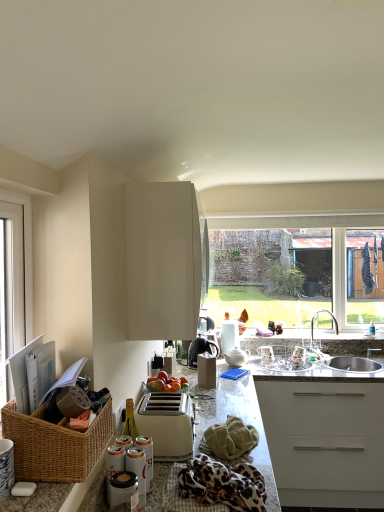
Question: Do you think white plastic toaster at center is within metallic silver can at lower center, the 1th appliance when ordered from front to back, or outside of it?

Choices:
 (A) outside
 (B) inside

Answer: (A)

Question: From a real-world perspective, is white plastic toaster at center above or below metallic silver can at lower center, which is the third appliance in back-to-front order?

Choices:
 (A) below
 (B) above

Answer: (B)

Question: Estimate the real-world distances between objects in this image. Which object is closer to the white plastic toaster at center?

Choices:
 (A) satin nickel faucet at sink right
 (B) white plastic window at left
 (C) leopard print fabric at lower center
 (D) green textured towel at lower center
 (E) matte black coffee maker at center, positioned as the second appliance in left-to-right order

Answer: (D)

Question: Estimate the real-world distances between objects in this image. Which object is closer to the woven brown basket at lower left?

Choices:
 (A) white plastic window at left
 (B) metallic silver can at lower center, positioned as the first appliance in left-to-right order
 (C) granite countertop at center
 (D) white ceramic teapot at center, the first appliance when ordered from right to left
 (E) green textured towel at lower center

Answer: (B)